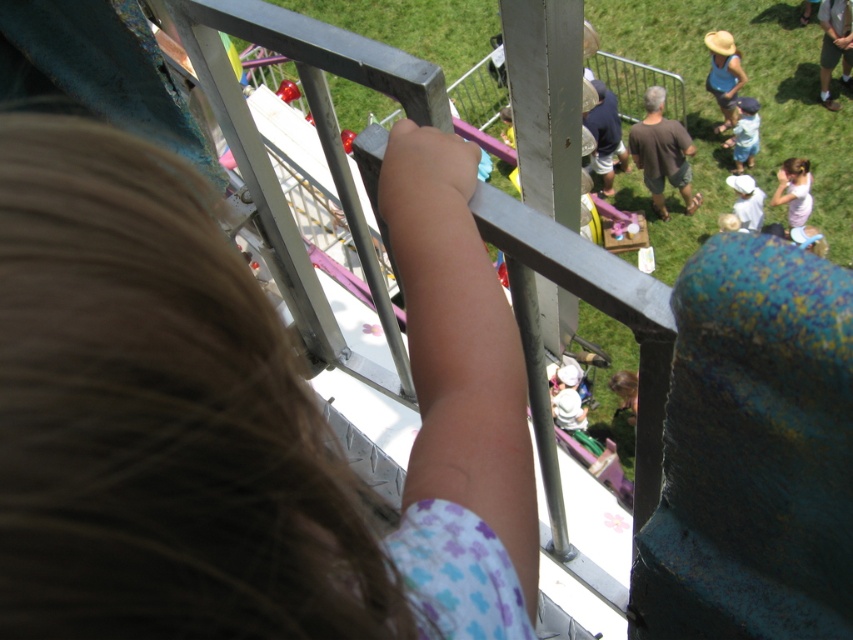
Does blonde hair at upper left appear on the left side of brown cotton shirt at center?

Indeed, blonde hair at upper left is positioned on the left side of brown cotton shirt at center.

What do you see at coordinates (235, 416) in the screenshot?
I see `blonde hair at upper left` at bounding box center [235, 416].

The width and height of the screenshot is (853, 640). Describe the element at coordinates (235, 416) in the screenshot. I see `blonde hair at upper left` at that location.

What are the coordinates of `blonde hair at upper left` in the screenshot? It's located at (235, 416).